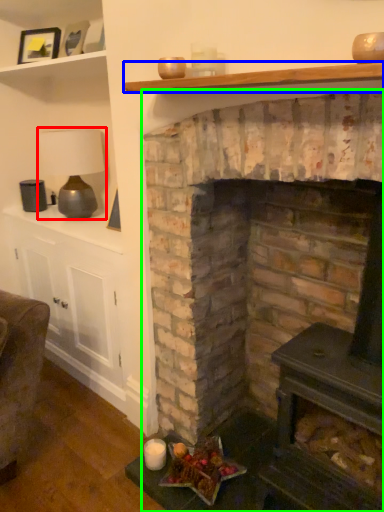
Question: Which object is positioned farthest from lamp (highlighted by a red box)? Select from shelf (highlighted by a blue box) and fireplace (highlighted by a green box).

Choices:
 (A) shelf
 (B) fireplace

Answer: (A)